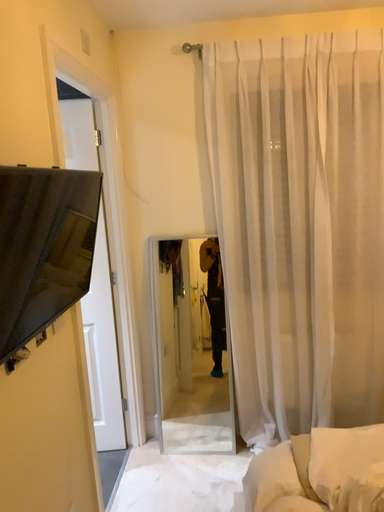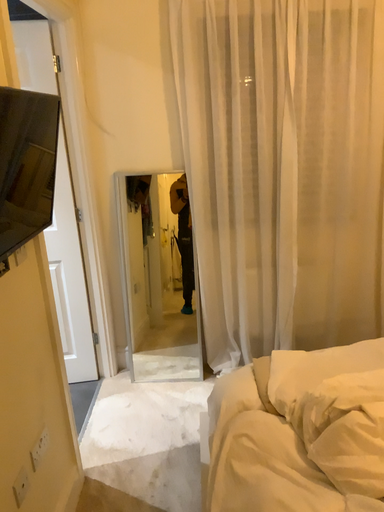
Question: Which way did the camera rotate in the video?

Choices:
 (A) rotated downward
 (B) rotated upward

Answer: (A)